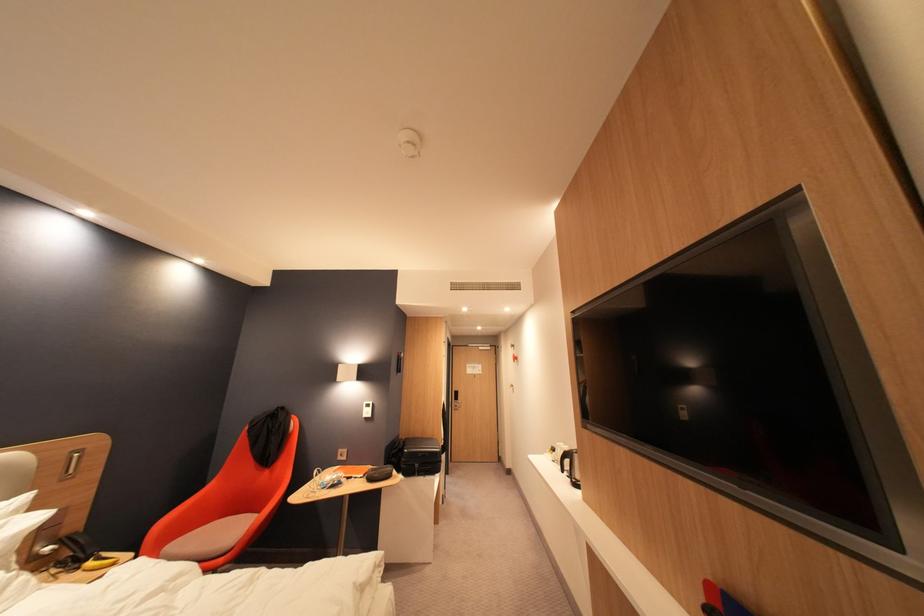
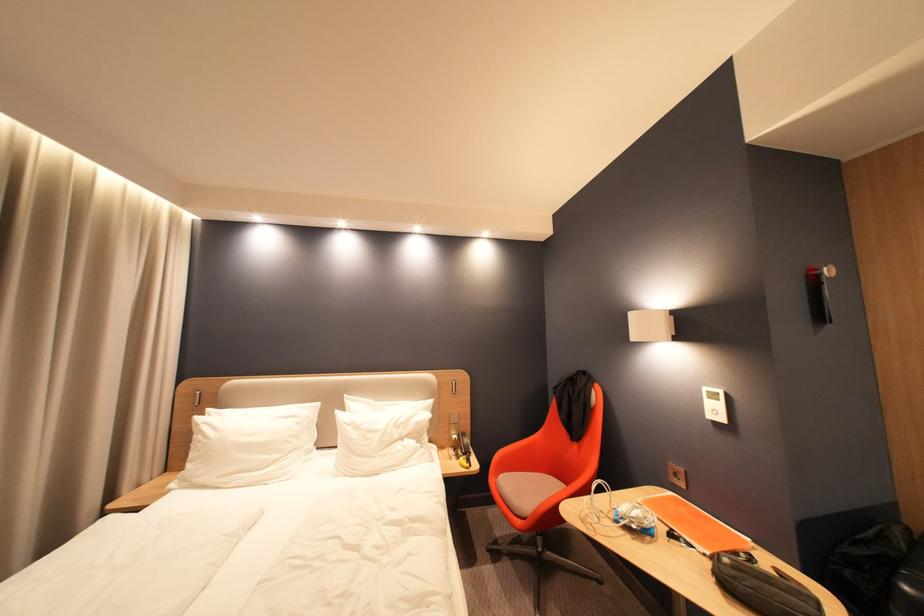
Where in the second image is the point corresponding to pixel 319 499 from the first image?

(592, 523)